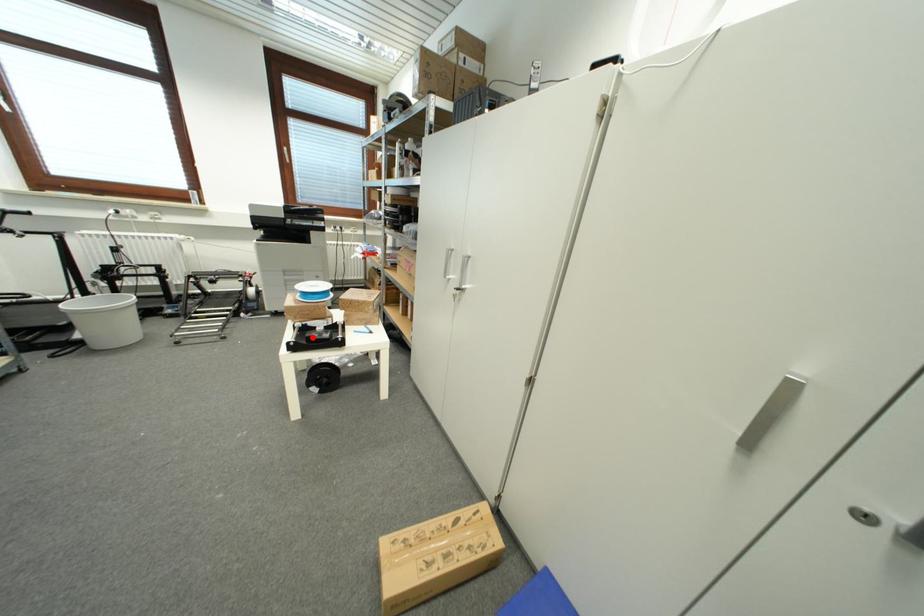
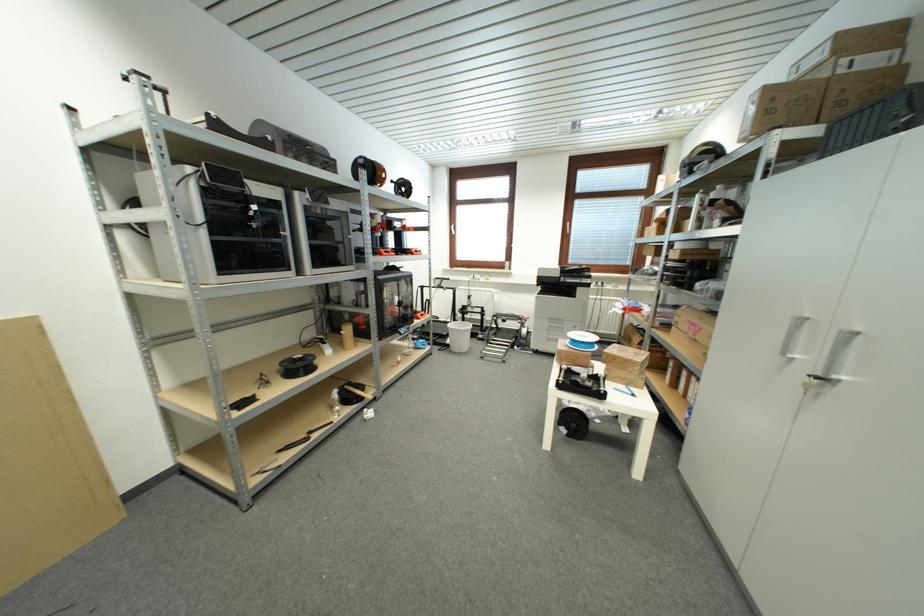
In the second image, find the point that corresponds to the highlighted location in the first image.

(578, 381)